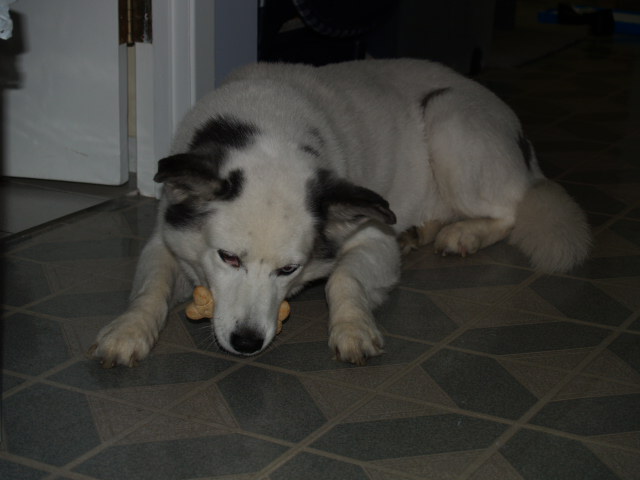
You are a GUI agent. You are given a task and a screenshot of the screen. Output one action in this format:
    pyautogui.click(x=<x>, y=<y>)
    Task: Click on the door hinge
    
    Given the screenshot: What is the action you would take?
    pyautogui.click(x=134, y=21)